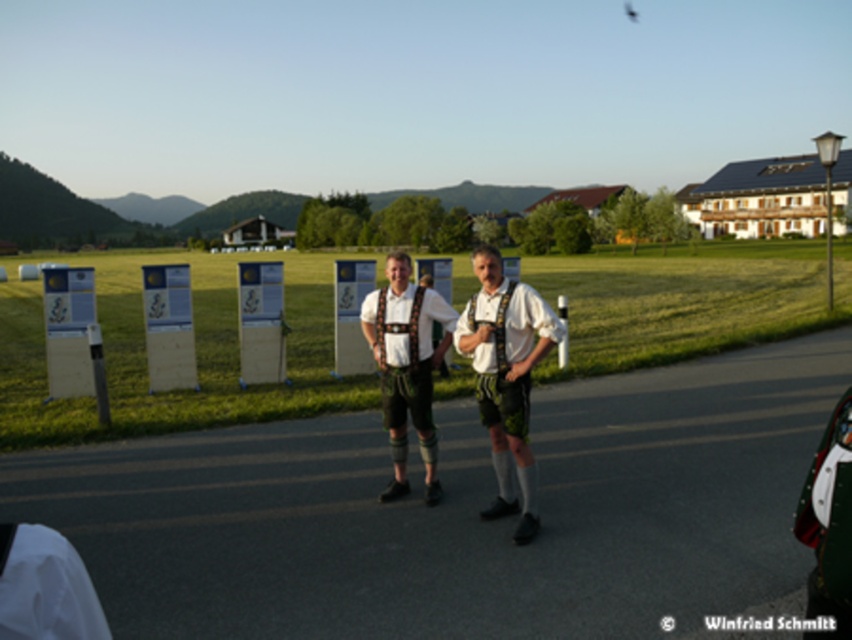
Question: Where is matte white shirt at center located in relation to khaki fabric at lower left in the image?

Choices:
 (A) right
 (B) left

Answer: (A)

Question: Does matte white shirt at center appear on the left side of leather-like suspenders at center?

Choices:
 (A) no
 (B) yes

Answer: (A)

Question: Which point appears farthest from the camera in this image?

Choices:
 (A) (15, 525)
 (B) (435, 349)

Answer: (B)

Question: Which point is closer to the camera?

Choices:
 (A) (44, 560)
 (B) (504, 428)
 (C) (413, 410)

Answer: (A)

Question: Considering the relative positions of matte white shirt at center and leather-like suspenders at center in the image provided, where is matte white shirt at center located with respect to leather-like suspenders at center?

Choices:
 (A) left
 (B) right

Answer: (B)

Question: Which point is closer to the camera?

Choices:
 (A) (435, 438)
 (B) (486, 378)

Answer: (B)